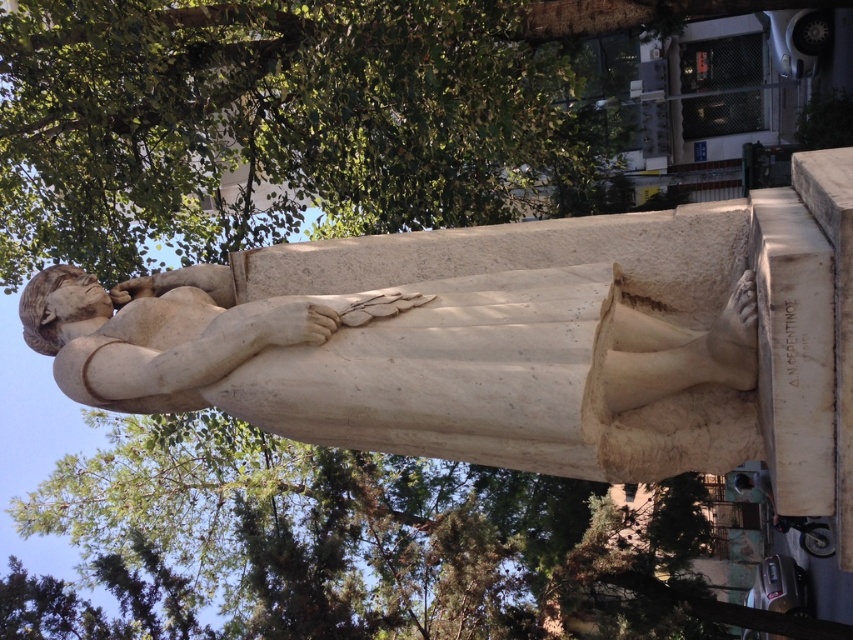
Which is below, green leafy tree at upper center or white marble statue at center?

white marble statue at center is lower down.

Is green leafy tree at upper center positioned in front of white marble statue at center?

No.

The height and width of the screenshot is (640, 853). I want to click on green leafy tree at upper center, so click(x=271, y=122).

Locate an element on the screen. The image size is (853, 640). green leafy tree at upper center is located at coordinates (271, 122).